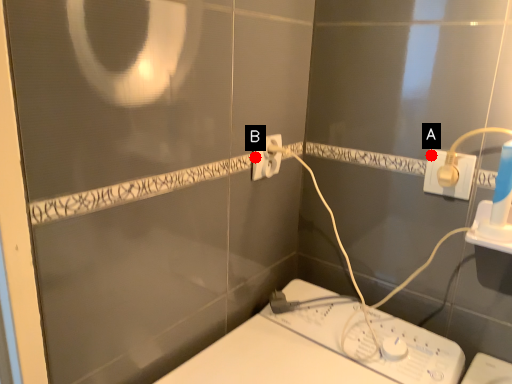
Question: Two points are circled on the image, labeled by A and B beside each circle. Which point is closer to the camera taking this photo?

Choices:
 (A) A is closer
 (B) B is closer

Answer: (A)